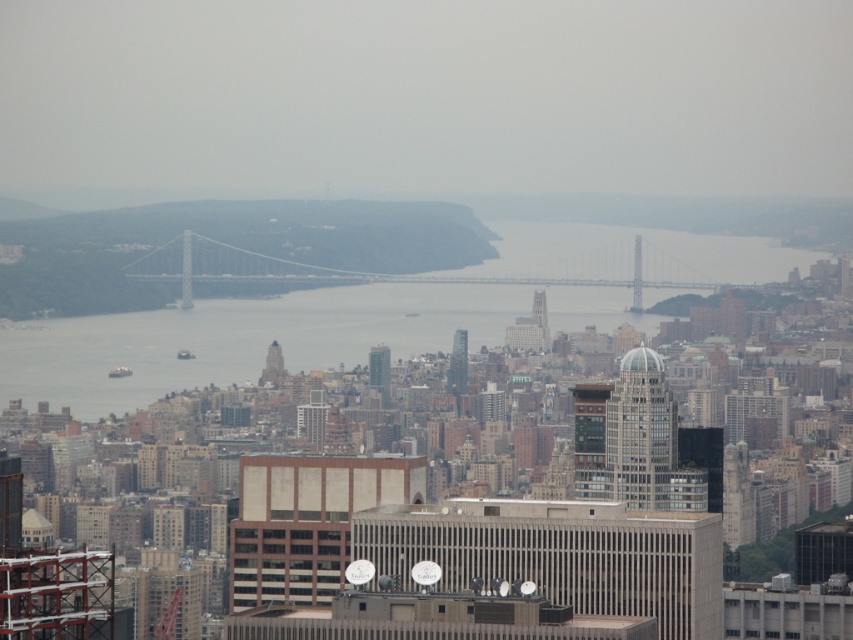
Consider the image. You are a drone operator tasked with flying a drone from the beige concrete building at center to the glassy skyscraper at center. Based on the scene, will the drone have an unobstructed path between these two structures?

The glassy skyscraper at center is behind the beige concrete building at center, so the drone will not have an unobstructed path between these two structures as the beige concrete building is blocking the path.

You are standing at the point labeled point (641,433) in the image. What structure are you directly facing?

The point (641,433) corresponds to the clear glass skyscraper at center, so you are directly facing the clear glass skyscraper at center.

You are an architect analyzing the urban layout. From your vantage point, which skyscraper is closer to you, the clear glass skyscraper at center or the glassy silver skyscraper at center?

The clear glass skyscraper at center is closer to you because the glassy silver skyscraper at center is positioned behind it.